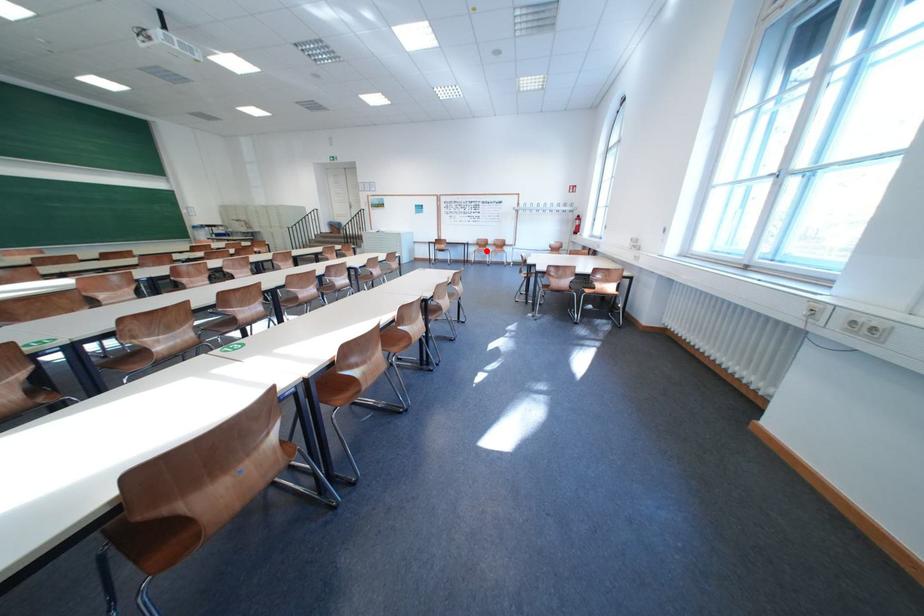
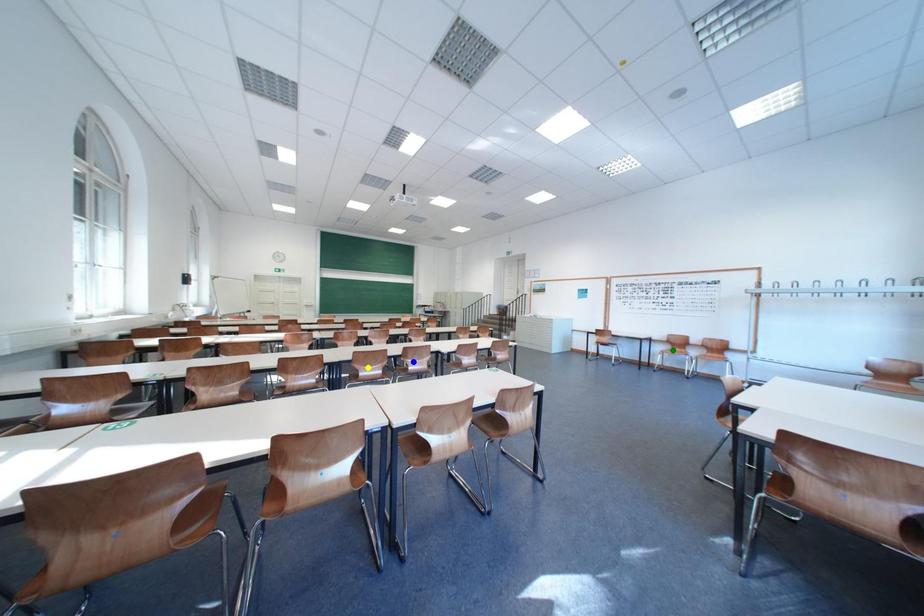
Question: I am providing you with two images of the same scene from different viewpoints. A red point is marked on the first image. You are given multiple points on the second image. Which mark in image 2 goes with the point in image 1?

Choices:
 (A) yellow point
 (B) blue point
 (C) green point

Answer: (C)